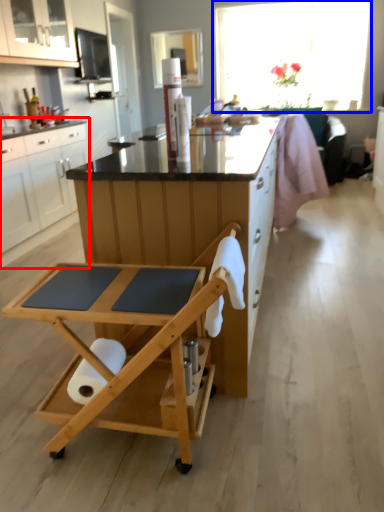
Question: Which object is further to the camera taking this photo, cabinetry (highlighted by a red box) or window (highlighted by a blue box)?

Choices:
 (A) cabinetry
 (B) window

Answer: (B)